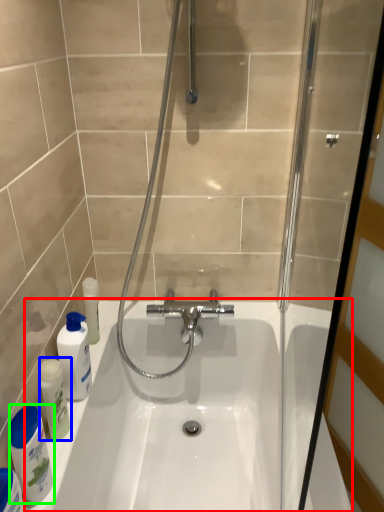
Question: Considering the real-world distances, which object is farthest from bath (highlighted by a red box)? cleaning product (highlighted by a blue box) or cleaning product (highlighted by a green box)?

Choices:
 (A) cleaning product
 (B) cleaning product

Answer: (B)